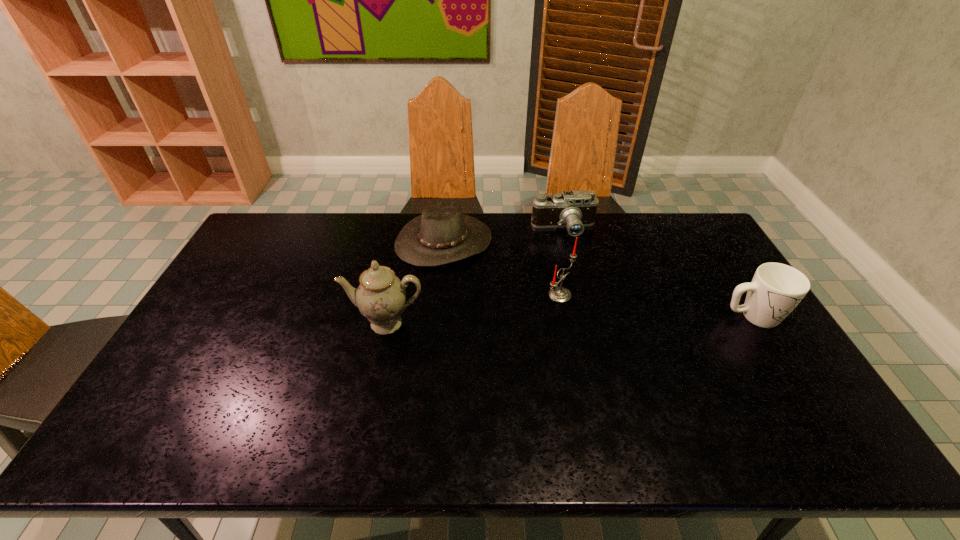
The image size is (960, 540). Identify the location of the tallest object. (381, 296).

Identify the location of mug. (776, 289).

You are a GUI agent. You are given a task and a screenshot of the screen. Output one action in this format:
    pyautogui.click(x=<x>, y=<y>)
    Task: Click on the camera
    This screenshot has height=540, width=960.
    Given the screenshot: What is the action you would take?
    pyautogui.click(x=574, y=210)

Where is `hat`? The image size is (960, 540). hat is located at coordinates (442, 234).

Locate an element on the screen. candle is located at coordinates (558, 294).

You are a GUI agent. You are given a task and a screenshot of the screen. Output one action in this format:
    pyautogui.click(x=<x>, y=<y>)
    Task: Click on the vacant area situated on the spout of the tallest object
    The height and width of the screenshot is (540, 960).
    Given the screenshot: What is the action you would take?
    click(377, 364)

Find the location of `free space located 0.220m at the lens of the camera`. free space located 0.220m at the lens of the camera is located at coordinates (x=569, y=285).

Locate an element on the screen. vacant region located 0.360m at the lens of the camera is located at coordinates (573, 317).

Locate an element on the screen. The width and height of the screenshot is (960, 540). free space located 0.170m at the lens of the camera is located at coordinates (568, 274).

The height and width of the screenshot is (540, 960). I want to click on vacant area situated on the front-facing side of the hat, so click(x=533, y=336).